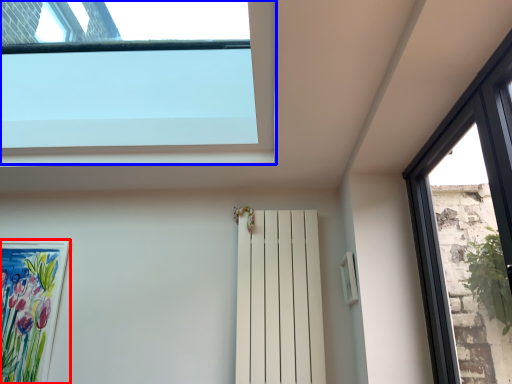
Question: Which point is closer to the camera, picture frame (highlighted by a red box) or window (highlighted by a blue box)?

Choices:
 (A) picture frame
 (B) window

Answer: (B)